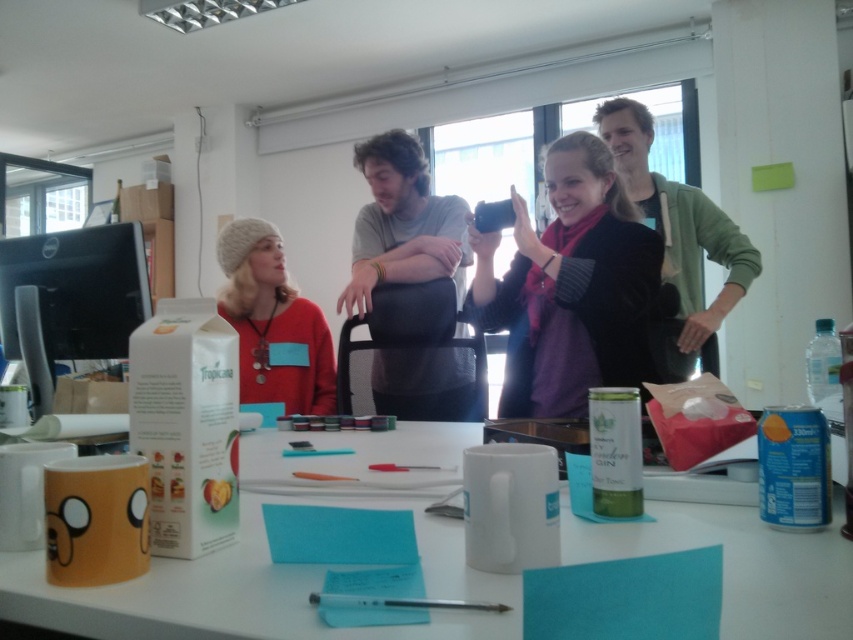
Can you confirm if matte black camera at center is positioned above knitted wool beanie at upper left?

Yes.

This screenshot has height=640, width=853. What are the coordinates of `matte black camera at center` in the screenshot? It's located at (570, 288).

This screenshot has width=853, height=640. In order to click on matte black camera at center in this screenshot , I will do `click(570, 288)`.

Does black glossy monitor at left lie in front of green fleece jacket at upper right?

Yes.

Is black glossy monitor at left taller than green fleece jacket at upper right?

Incorrect, black glossy monitor at left's height is not larger of green fleece jacket at upper right's.

The image size is (853, 640). I want to click on black glossy monitor at left, so tap(70, 300).

Who is higher up, gray cotton shirt at center or green fleece jacket at upper right?

Positioned higher is green fleece jacket at upper right.

Which is more to the right, gray cotton shirt at center or green fleece jacket at upper right?

green fleece jacket at upper right

Who is more distant from viewer, [422,182] or [701,211]?

Positioned behind is point [701,211].

Find the location of `gray cotton shirt at center`. gray cotton shirt at center is located at coordinates 413,288.